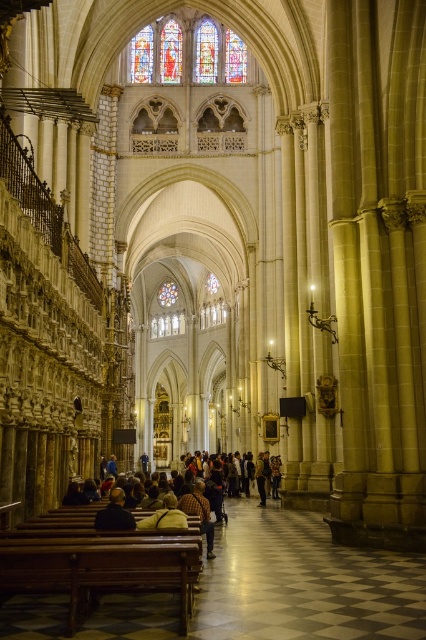
You are standing at the entrance of the cathedral and want to sit on the brown polished wood bench at lower left. Based on its 2D coordinates, in which general direction should you walk from your current position to reach it?

The brown polished wood bench at lower left is located at coordinates point [100,566], which places it towards the lower left area of the scene. From the entrance, you should walk towards the lower left direction to reach it.

You are standing at the front of the nave in the cathedral. There is a point marked at coordinates (x=186, y=52). What object does this point correspond to?

The point at coordinates (x=186, y=52) corresponds to the stained glass window at upper center.

You are standing in the cathedral and want to move from point A to point B. Point A is located at coordinates point [176,477] and point B is at point [187,522]. Which point is closer to the altar area?

Point [187,522] is closer to the altar area because it is in front of point [176,477], which is behind it.